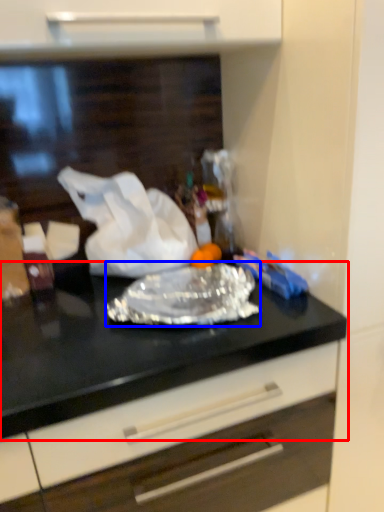
Question: Which point is further to the camera, countertop (highlighted by a red box) or wrap (highlighted by a blue box)?

Choices:
 (A) countertop
 (B) wrap

Answer: (B)